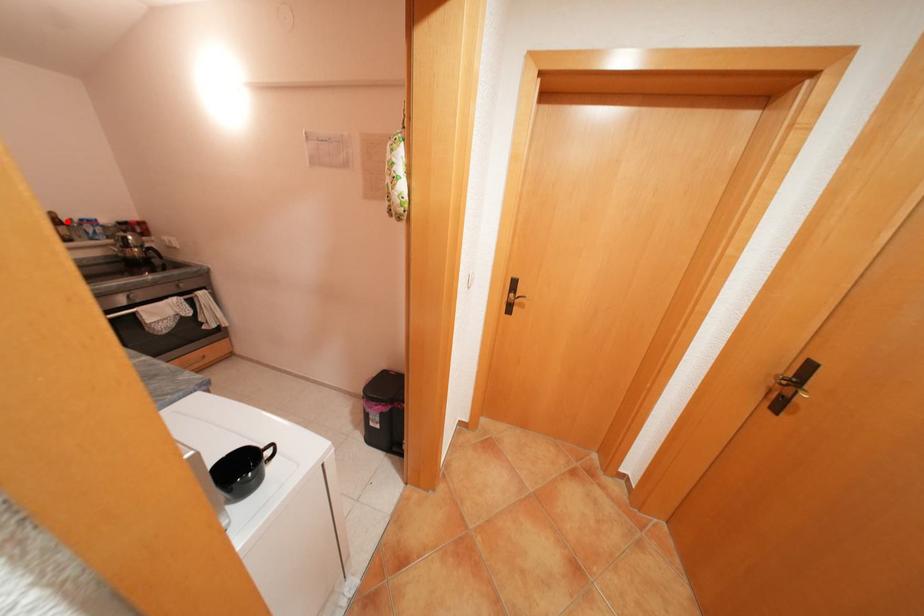
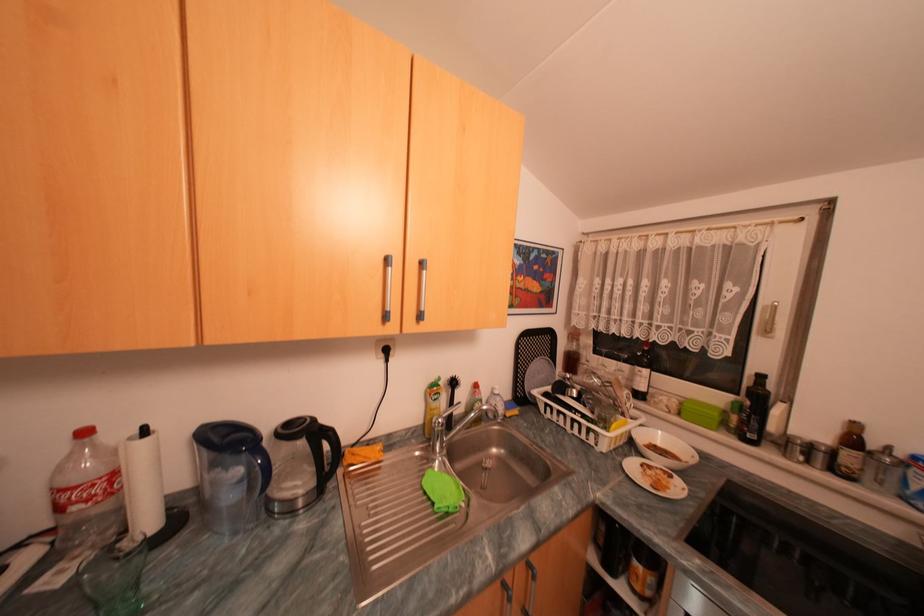
Locate, in the second image, the point that corresponds to the highlighted location in the first image.

(862, 440)